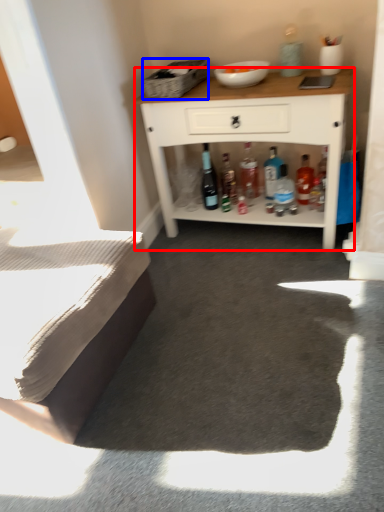
Question: Among these objects, which one is nearest to the camera, cabinetry (highlighted by a red box) or picnic basket (highlighted by a blue box)?

Choices:
 (A) cabinetry
 (B) picnic basket

Answer: (A)